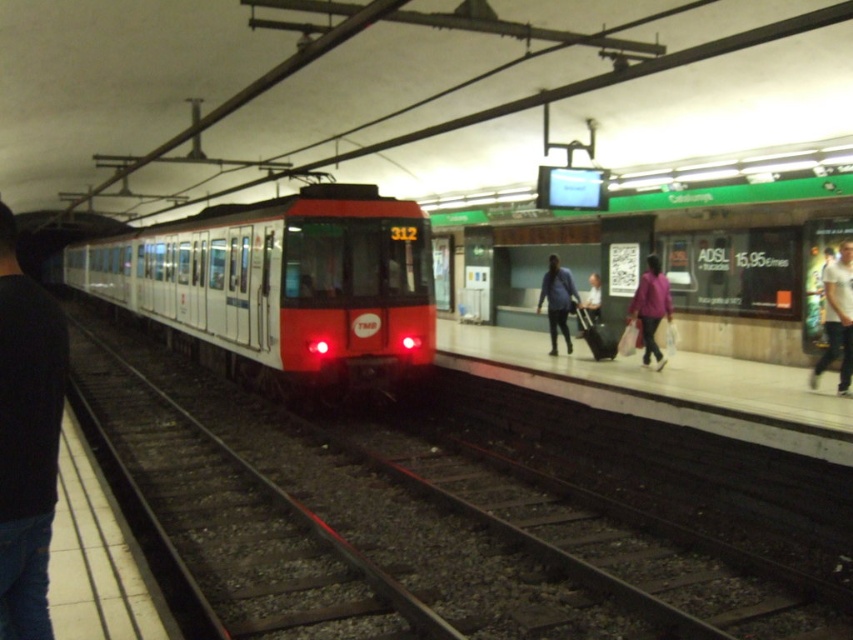
Question: Considering the real-world distances, which object is farthest from the blue denim jacket at center?

Choices:
 (A) white metal track at center
 (B) matte white train at center
 (C) white cotton shirt at right

Answer: (B)

Question: Based on their relative distances, which object is farther from the matte white train at center?

Choices:
 (A) purple fabric jacket at right
 (B) blue denim jacket at center

Answer: (B)

Question: Is black fabric at left positioned at the back of white cotton shirt at right?

Choices:
 (A) no
 (B) yes

Answer: (A)

Question: Which point is closer to the camera?

Choices:
 (A) (55, 371)
 (B) (793, 416)
 (C) (323, 188)

Answer: (A)

Question: From the image, what is the correct spatial relationship of white concrete platform at center in relation to white cotton shirt at right?

Choices:
 (A) left
 (B) right

Answer: (A)

Question: Can you confirm if white concrete platform at center is positioned above black fabric at left?

Choices:
 (A) yes
 (B) no

Answer: (B)